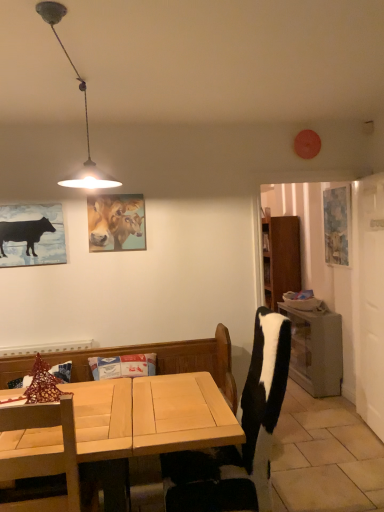
What do you see at coordinates (44, 454) in the screenshot?
I see `wooden chair at lower left, which is the first chair in left-to-right order` at bounding box center [44, 454].

The height and width of the screenshot is (512, 384). In order to click on blue textured painting at right, the first picture frame in the right-to-left sequence in this screenshot , I will do `click(337, 224)`.

Measure the distance between point (41, 223) and camera.

They are 3.06 meters apart.

In order to face wooden table at right, should I rotate leftwards or rightwards?

To align with it, rotate right about 15.073°.

The image size is (384, 512). I want to click on black and white fabric chair at center, which is counted as the second chair, starting from the left, so click(245, 435).

From the image's perspective, who appears lower, metallic pendant light at upper left or matte wooden picture frame at upper center, the 2th picture frame positioned from the right?

matte wooden picture frame at upper center, the 2th picture frame positioned from the right, is shown below in the image.

Looking at this image, which object is closer to the camera, metallic pendant light at upper left or matte wooden picture frame at upper center, the 2th picture frame positioned from the right?

metallic pendant light at upper left.

From a real-world perspective, between metallic pendant light at upper left and matte wooden picture frame at upper center, which is the second picture frame in back-to-front order, who is vertically lower?

matte wooden picture frame at upper center, which is the second picture frame in back-to-front order, is physically lower.

I want to click on lamp that appears on the right of matte wooden picture frame at upper center, which is counted as the first picture frame, starting from the front, so click(85, 111).

I want to click on picture frame that is the 1st one when counting backward from the wooden chair at lower left, which is the first chair in left-to-right order, so click(x=115, y=221).

How many degrees apart are the facing directions of matte wooden picture frame at upper center, the 1th picture frame in the left-to-right sequence, and wooden chair at lower left, which is the 2th chair in right-to-left order?

The facing directions of matte wooden picture frame at upper center, the 1th picture frame in the left-to-right sequence, and wooden chair at lower left, which is the 2th chair in right-to-left order, are 179 degrees apart.

Is matte wooden picture frame at upper center, which is the second picture frame in back-to-front order, at the left side of wooden chair at lower left, which is the first chair in left-to-right order?

Incorrect, matte wooden picture frame at upper center, which is the second picture frame in back-to-front order, is not on the left side of wooden chair at lower left, which is the first chair in left-to-right order.

Which is correct: matte wooden picture frame at upper center, the 2th picture frame positioned from the right, is inside wooden chair at lower left, which is the 2th chair in right-to-left order, or outside of it?

matte wooden picture frame at upper center, the 2th picture frame positioned from the right, is spatially situated outside wooden chair at lower left, which is the 2th chair in right-to-left order.

Which is further, (123, 223) or (50, 4)?

The point (123, 223) is farther from the camera.

Which is behind, matte wooden picture frame at upper center, which is counted as the first picture frame, starting from the front, or metallic pendant light at upper left?

matte wooden picture frame at upper center, which is counted as the first picture frame, starting from the front.

Is matte wooden picture frame at upper center, the 1th picture frame in the left-to-right sequence, positioned with its back to metallic pendant light at upper left?

That's not correct — matte wooden picture frame at upper center, the 1th picture frame in the left-to-right sequence, is not looking away from metallic pendant light at upper left.

In the scene shown: From a real-world perspective, does matte wooden picture frame at upper center, the 2th picture frame positioned from the right, sit lower than metallic pendant light at upper left?

Indeed, from a real-world perspective, matte wooden picture frame at upper center, the 2th picture frame positioned from the right, is positioned beneath metallic pendant light at upper left.

Is matte wooden picture frame at upper center, the 1th picture frame in the left-to-right sequence, wider than black matte cow at left?

Yes, matte wooden picture frame at upper center, the 1th picture frame in the left-to-right sequence, is wider than black matte cow at left.

Are matte wooden picture frame at upper center, the 2th picture frame positioned from the right, and black matte cow at left beside each other?

No, matte wooden picture frame at upper center, the 2th picture frame positioned from the right, is not with black matte cow at left.

Visually, is matte wooden picture frame at upper center, the 1th picture frame in the left-to-right sequence, positioned to the left or to the right of black matte cow at left?

From the image, it's evident that matte wooden picture frame at upper center, the 1th picture frame in the left-to-right sequence, is to the right of black matte cow at left.

Could you tell me if matte wooden picture frame at upper center, which is counted as the first picture frame, starting from the front, is turned towards black matte cow at left?

No, matte wooden picture frame at upper center, which is counted as the first picture frame, starting from the front, is not turned towards black matte cow at left.

From the image's perspective, which is below, wooden table at right or metallic pendant light at upper left?

From the image's view, wooden table at right is below.

Does wooden table at right touch metallic pendant light at upper left?

No, wooden table at right is not touching metallic pendant light at upper left.

From their relative heights in the image, would you say wooden table at right is taller or shorter than metallic pendant light at upper left?

In the image, wooden table at right appears to be taller than metallic pendant light at upper left.

Between wooden table at right and metallic pendant light at upper left, which one has smaller size?

metallic pendant light at upper left is smaller.

From a real-world perspective, is blue textured painting at right, the first picture frame in the right-to-left sequence, below wooden table at right?

Incorrect, from a real-world perspective, blue textured painting at right, the first picture frame in the right-to-left sequence, is higher than wooden table at right.

Can you tell me how much blue textured painting at right, the 2th picture frame viewed from the left, and wooden table at right differ in facing direction?

There is a 0.182-degree angle between the facing directions of blue textured painting at right, the 2th picture frame viewed from the left, and wooden table at right.

Is blue textured painting at right, the first picture frame in the right-to-left sequence, oriented away from wooden table at right?

No.

Is blue textured painting at right, the 2th picture frame viewed from the left, completely or partially outside of wooden chair at lower left, which is the 2th chair in right-to-left order?

Yes, blue textured painting at right, the 2th picture frame viewed from the left, is outside of wooden chair at lower left, which is the 2th chair in right-to-left order.

In the image, is blue textured painting at right, which is counted as the 2th picture frame, starting from the front, positioned in front of or behind wooden chair at lower left, which is the first chair in left-to-right order?

Clearly, blue textured painting at right, which is counted as the 2th picture frame, starting from the front, is behind wooden chair at lower left, which is the first chair in left-to-right order.

Can you confirm if blue textured painting at right, the first picture frame in the right-to-left sequence, is positioned to the left of wooden chair at lower left, which is the 2th chair in right-to-left order?

Incorrect, blue textured painting at right, the first picture frame in the right-to-left sequence, is not on the left side of wooden chair at lower left, which is the 2th chair in right-to-left order.

From the image's perspective, would you say blue textured painting at right, acting as the first picture frame starting from the back, is positioned over wooden chair at lower left, which is the first chair in left-to-right order?

Indeed, from the image's perspective, blue textured painting at right, acting as the first picture frame starting from the back, is shown above wooden chair at lower left, which is the first chair in left-to-right order.

Locate an element on the screen. Image resolution: width=384 pixels, height=512 pixels. lamp above the matte wooden picture frame at upper center, the 1th picture frame in the left-to-right sequence (from a real-world perspective) is located at coordinates (85, 111).

Where is `the 1st chair below the matte wooden picture frame at upper center, the 2th picture frame positioned from the right (from the image's perspective)`? This screenshot has width=384, height=512. the 1st chair below the matte wooden picture frame at upper center, the 2th picture frame positioned from the right (from the image's perspective) is located at coordinates (44, 454).

Looking at the image, which one is located closer to matte wooden picture frame at upper center, which is the second picture frame in back-to-front order, wooden table at right or metallic pendant light at upper left?

metallic pendant light at upper left is closer to matte wooden picture frame at upper center, which is the second picture frame in back-to-front order.

Estimate the real-world distances between objects in this image. Which object is further from matte wooden picture frame at upper center, which is counted as the first picture frame, starting from the front, metallic pendant light at upper left or black matte cow at left?

metallic pendant light at upper left lies further to matte wooden picture frame at upper center, which is counted as the first picture frame, starting from the front, than the other object.

When comparing their distances from metallic pendant light at upper left, does matte wooden picture frame at upper center, the 1th picture frame in the left-to-right sequence, or wooden chair at lower left, which is the first chair in left-to-right order, seem closer?

Among the two, matte wooden picture frame at upper center, the 1th picture frame in the left-to-right sequence, is located nearer to metallic pendant light at upper left.

From the image, which object appears to be farther from black and white fabric chair at center, which is counted as the second chair, starting from the left, blue textured painting at right, the first picture frame in the right-to-left sequence, or light wood desk at lower left?

The object further to black and white fabric chair at center, which is counted as the second chair, starting from the left, is blue textured painting at right, the first picture frame in the right-to-left sequence.

Which object lies further to the anchor point blue textured painting at right, which is counted as the 2th picture frame, starting from the front, wooden table at right or black matte cow at left?

The object further to blue textured painting at right, which is counted as the 2th picture frame, starting from the front, is black matte cow at left.

In the scene shown: From the image, which object appears to be nearer to blue textured painting at right, which is counted as the 2th picture frame, starting from the front, metallic pendant light at upper left or light wood desk at lower left?

Answer: Based on the image, light wood desk at lower left appears to be nearer to blue textured painting at right, which is counted as the 2th picture frame, starting from the front.

Considering their positions, is wooden table at right positioned closer to blue textured painting at right, the first picture frame in the right-to-left sequence, than light wood desk at lower left?

Among the two, wooden table at right is located nearer to blue textured painting at right, the first picture frame in the right-to-left sequence.

From the image, which object appears to be nearer to wooden table at right, black and white fabric chair at center, which is the 1th chair from right to left, or light wood desk at lower left?

The object closer to wooden table at right is black and white fabric chair at center, which is the 1th chair from right to left.

The width and height of the screenshot is (384, 512). I want to click on chair between wooden chair at lower left, which is the 2th chair in right-to-left order, and wooden table at right in the front-back direction, so click(245, 435).

Find the location of a particular element. This screenshot has height=512, width=384. desk located between black matte cow at left and blue textured painting at right, which is counted as the 2th picture frame, starting from the front, in the left-right direction is located at coordinates (147, 421).

Find the location of a particular element. cattle located between metallic pendant light at upper left and wooden table at right in the depth direction is located at coordinates tap(24, 233).

Locate an element on the screen. This screenshot has height=512, width=384. chair between wooden chair at lower left, which is the 2th chair in right-to-left order, and matte wooden picture frame at upper center, the 1th picture frame in the left-to-right sequence, along the z-axis is located at coordinates (245, 435).